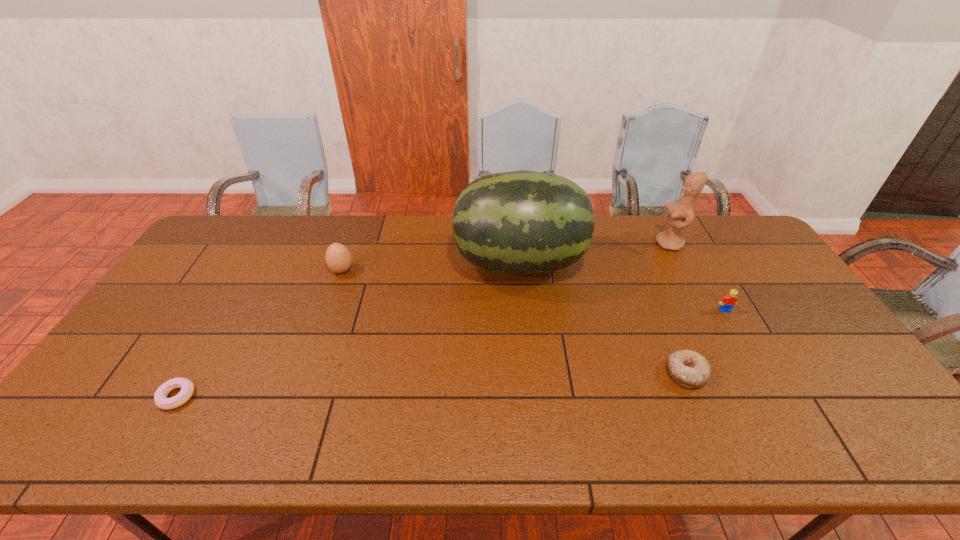
You are a GUI agent. You are given a task and a screenshot of the screen. Output one action in this format:
    pyautogui.click(x=<x>, y=<y>)
    Task: Click on the free space located 0.250m on the right of the fourth object from right to left
    The height and width of the screenshot is (540, 960).
    Given the screenshot: What is the action you would take?
    pyautogui.click(x=660, y=264)

Where is `vacant position located on the front-facing side of the fifth shortest object`? vacant position located on the front-facing side of the fifth shortest object is located at coordinates (566, 244).

Locate an element on the screen. vacant space situated on the front-facing side of the fifth shortest object is located at coordinates (555, 244).

Find the location of a particular element. The width and height of the screenshot is (960, 540). free space located 0.300m on the front-facing side of the fifth shortest object is located at coordinates (569, 244).

Locate an element on the screen. The width and height of the screenshot is (960, 540). vacant space located 0.110m on the left of the fourth shortest object is located at coordinates (296, 270).

Locate an element on the screen. This screenshot has height=540, width=960. free space located on the face of the fourth tallest object is located at coordinates (800, 442).

Where is `vacant space located on the back of the third object from right to left`? The width and height of the screenshot is (960, 540). vacant space located on the back of the third object from right to left is located at coordinates (644, 271).

The image size is (960, 540). Find the location of `free space located 0.150m on the right of the leftmost object`. free space located 0.150m on the right of the leftmost object is located at coordinates (255, 396).

At what (x,y) coordinates should I click in order to perform the action: click on watermelon that is at the far edge. Please return your answer as a coordinate pair (x, y). Looking at the image, I should click on (522, 222).

Identify the location of figurine that is at the far edge. (680, 213).